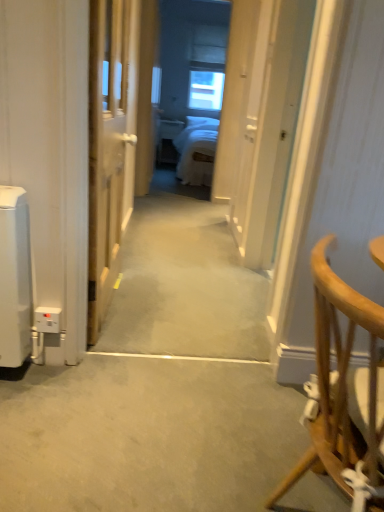
Image resolution: width=384 pixels, height=512 pixels. Identify the location of gray carpet at center, which ranks as the 1th path in front-to-back order. 159,386.

What do you see at coordinates (184, 286) in the screenshot? I see `carpeted hallway at center, the 1th path when ordered from top to bottom` at bounding box center [184, 286].

Locate an element on the screen. carpeted hallway at center, the 1th path when ordered from top to bottom is located at coordinates (184, 286).

This screenshot has height=512, width=384. In order to click on light brown wooden chair at right in this screenshot , I will do `click(344, 394)`.

Who is taller, carpeted hallway at center, the 2th path positioned from the bottom, or light brown wooden chair at right?

Standing taller between the two is light brown wooden chair at right.

Which object is thinner, carpeted hallway at center, the 2th path positioned from the bottom, or light brown wooden chair at right?

light brown wooden chair at right is thinner.

Could you tell me if carpeted hallway at center, the second path viewed from the front, is turned towards light brown wooden chair at right?

No, carpeted hallway at center, the second path viewed from the front, is not oriented towards light brown wooden chair at right.

From a real-world perspective, which object stands above the other?

transparent glass window at center.

Considering the positions of objects transparent glass window at center and carpeted hallway at center, the second path viewed from the front, in the image provided, who is in front, transparent glass window at center or carpeted hallway at center, the second path viewed from the front,?

carpeted hallway at center, the second path viewed from the front, is closer to the camera.

Is transparent glass window at center aimed at carpeted hallway at center, the 1th path when ordered from top to bottom?

Yes.

Considering the sizes of objects transparent glass window at center and carpeted hallway at center, the 1th path when ordered from top to bottom, in the image provided, who is bigger, transparent glass window at center or carpeted hallway at center, the 1th path when ordered from top to bottom,?

Bigger between the two is carpeted hallway at center, the 1th path when ordered from top to bottom.

Is carpeted hallway at center, the second path viewed from the front, beside transparent glass window at center?

There is a gap between carpeted hallway at center, the second path viewed from the front, and transparent glass window at center.

Can you confirm if carpeted hallway at center, placed as the first path when sorted from back to front, is shorter than transparent glass window at center?

Yes, carpeted hallway at center, placed as the first path when sorted from back to front, is shorter than transparent glass window at center.

Is carpeted hallway at center, the 2th path positioned from the bottom, positioned in front of transparent glass window at center?

Yes.

Does carpeted hallway at center, the 2th path positioned from the bottom, appear on the right side of transparent glass window at center?

Incorrect, carpeted hallway at center, the 2th path positioned from the bottom, is not on the right side of transparent glass window at center.

From a real-world perspective, is gray carpet at center, which ranks as the second path in top-to-bottom order, located higher than carpeted hallway at center, placed as the first path when sorted from back to front?

No, from a real-world perspective, gray carpet at center, which ranks as the second path in top-to-bottom order, is not above carpeted hallway at center, placed as the first path when sorted from back to front.

In terms of height, does gray carpet at center, the 2th path in the back-to-front sequence, look taller or shorter compared to carpeted hallway at center, the 2th path positioned from the bottom?

Clearly, gray carpet at center, the 2th path in the back-to-front sequence, is shorter compared to carpeted hallway at center, the 2th path positioned from the bottom.

Is gray carpet at center, which ranks as the second path in top-to-bottom order, in contact with carpeted hallway at center, placed as the first path when sorted from back to front?

gray carpet at center, which ranks as the second path in top-to-bottom order, is not next to carpeted hallway at center, placed as the first path when sorted from back to front, and they're not touching.

Does gray carpet at center, acting as the first path starting from the bottom, have a greater width compared to carpeted hallway at center, the 1th path when ordered from top to bottom?

In fact, gray carpet at center, acting as the first path starting from the bottom, might be narrower than carpeted hallway at center, the 1th path when ordered from top to bottom.

Is light brown wooden chair at right in contact with transparent glass window at center?

No, light brown wooden chair at right is not next to transparent glass window at center.

Between light brown wooden chair at right and transparent glass window at center, which one has larger width?

Wider between the two is light brown wooden chair at right.

Considering the relative positions of light brown wooden chair at right and transparent glass window at center in the image provided, is light brown wooden chair at right in front of transparent glass window at center?

Yes.

In terms of height, does carpeted hallway at center, the second path viewed from the front, look taller or shorter compared to wooden door at center?

In the image, carpeted hallway at center, the second path viewed from the front, appears to be shorter than wooden door at center.

Between point (144, 218) and point (118, 238), which one is positioned behind?

Positioned behind is point (144, 218).

Is the depth of carpeted hallway at center, placed as the first path when sorted from back to front, less than that of wooden door at center?

No, carpeted hallway at center, placed as the first path when sorted from back to front, is further to the viewer.

Is carpeted hallway at center, placed as the first path when sorted from back to front, in contact with wooden door at center?

carpeted hallway at center, placed as the first path when sorted from back to front, is not next to wooden door at center, and they're not touching.

From the image's perspective, which one is positioned lower, light brown wooden chair at right or gray carpet at center, which ranks as the 1th path in front-to-back order?

gray carpet at center, which ranks as the 1th path in front-to-back order, from the image's perspective.

Is light brown wooden chair at right facing away from gray carpet at center, which ranks as the 1th path in front-to-back order?

No, light brown wooden chair at right is not facing away from gray carpet at center, which ranks as the 1th path in front-to-back order.

Is light brown wooden chair at right to the left of gray carpet at center, which ranks as the second path in top-to-bottom order, from the viewer's perspective?

Incorrect, light brown wooden chair at right is not on the left side of gray carpet at center, which ranks as the second path in top-to-bottom order.

Can we say light brown wooden chair at right lies outside gray carpet at center, acting as the first path starting from the bottom?

That's correct, light brown wooden chair at right is outside of gray carpet at center, acting as the first path starting from the bottom.

Locate an element on the screen. The width and height of the screenshot is (384, 512). path located above the light brown wooden chair at right (from the image's perspective) is located at coordinates (184, 286).

Locate an element on the screen. The height and width of the screenshot is (512, 384). the 1st path in front of the transparent glass window at center, starting your count from the anchor is located at coordinates (184, 286).

Looking at the image, which one is located closer to gray carpet at center, which ranks as the 1th path in front-to-back order, light brown wooden chair at right or wooden door at center?

wooden door at center.

Which object lies nearer to the anchor point transparent glass window at center, light brown wooden chair at right or wooden door at center?

wooden door at center is positioned closer to the anchor transparent glass window at center.

Looking at the image, which one is located closer to gray carpet at center, acting as the first path starting from the bottom, wooden door at center or transparent glass window at center?

wooden door at center.

From the image, which object appears to be nearer to wooden door at center, light brown wooden chair at right or transparent glass window at center?

light brown wooden chair at right lies closer to wooden door at center than the other object.

From the image, which object appears to be farther from transparent glass window at center, gray carpet at center, acting as the first path starting from the bottom, or wooden door at center?

Based on the image, gray carpet at center, acting as the first path starting from the bottom, appears to be further to transparent glass window at center.

Considering their positions, is light brown wooden chair at right positioned further to carpeted hallway at center, the second path viewed from the front, than wooden door at center?

Based on the image, light brown wooden chair at right appears to be further to carpeted hallway at center, the second path viewed from the front.

Based on their spatial positions, is carpeted hallway at center, the second path viewed from the front, or wooden door at center further from light brown wooden chair at right?

carpeted hallway at center, the second path viewed from the front, is positioned further to the anchor light brown wooden chair at right.

Which object lies nearer to the anchor point wooden door at center, gray carpet at center, the 2th path in the back-to-front sequence, or transparent glass window at center?

Among the two, gray carpet at center, the 2th path in the back-to-front sequence, is located nearer to wooden door at center.

You are a GUI agent. You are given a task and a screenshot of the screen. Output one action in this format:
    pyautogui.click(x=<x>, y=<y>)
    Task: Click on the door between light brown wooden chair at right and transparent glass window at center along the z-axis
    The width and height of the screenshot is (384, 512).
    Given the screenshot: What is the action you would take?
    pyautogui.click(x=110, y=144)

Where is `path between wooden door at center and gray carpet at center, the 2th path in the back-to-front sequence, from top to bottom`? The height and width of the screenshot is (512, 384). path between wooden door at center and gray carpet at center, the 2th path in the back-to-front sequence, from top to bottom is located at coordinates (184, 286).

This screenshot has height=512, width=384. Identify the location of chair between wooden door at center and gray carpet at center, the 2th path in the back-to-front sequence, in the up-down direction. (344, 394).

The width and height of the screenshot is (384, 512). I want to click on path positioned between light brown wooden chair at right and carpeted hallway at center, placed as the first path when sorted from back to front, from near to far, so click(159, 386).